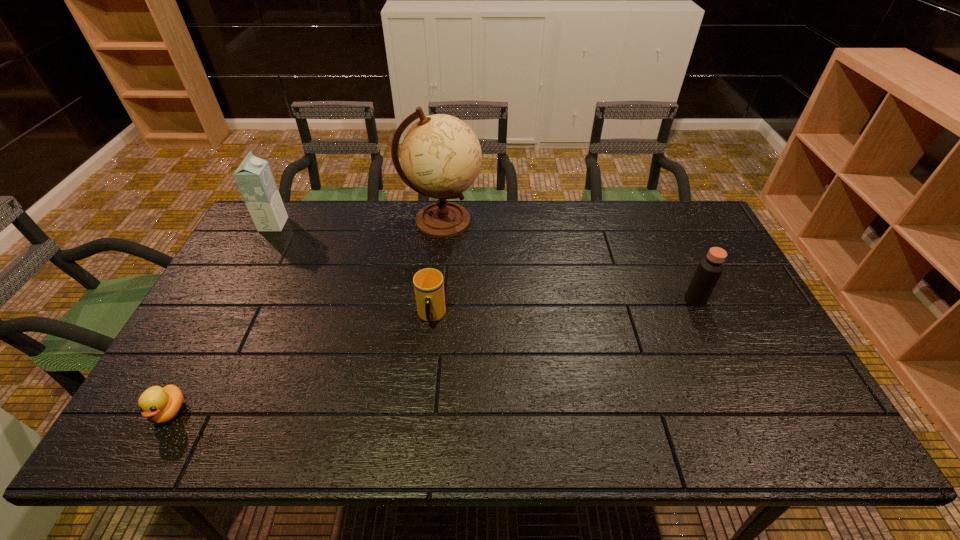
This screenshot has width=960, height=540. I want to click on vacant space at the near edge of the desktop, so click(x=321, y=416).

Find the location of a particular element. vacant area at the left edge of the desktop is located at coordinates (268, 245).

Find the location of a particular element. blank space at the right edge is located at coordinates (749, 338).

Find the location of a particular element. The height and width of the screenshot is (540, 960). vacant space at the far right corner of the desktop is located at coordinates (690, 232).

Where is `empty space between the tallest object and the second shortest object`? The width and height of the screenshot is (960, 540). empty space between the tallest object and the second shortest object is located at coordinates (437, 269).

This screenshot has height=540, width=960. What are the coordinates of `free spot between the duckling and the rightmost object` in the screenshot? It's located at (432, 355).

Locate an element on the screen. vacant space that is in between the vinegar and the second shortest object is located at coordinates (564, 308).

Find the location of a particular element. unoccupied position between the third shortest object and the second shortest object is located at coordinates (564, 308).

Where is `free point between the carton and the globe`? Image resolution: width=960 pixels, height=540 pixels. free point between the carton and the globe is located at coordinates (357, 222).

At what (x,y) coordinates should I click in order to perform the action: click on vacant space that is in between the shortest object and the third tallest object. Please return your answer as a coordinate pair (x, y). The height and width of the screenshot is (540, 960). Looking at the image, I should click on 432,355.